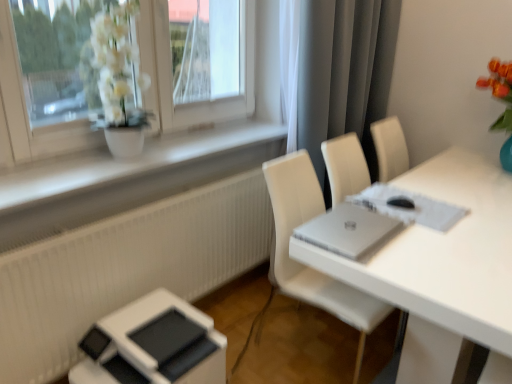
Identify the location of silver metallic laptop at center. (348, 230).

Looking at this image, measure the distance between point (353,33) and camera.

They are 2.29 meters apart.

The height and width of the screenshot is (384, 512). What do you see at coordinates (123, 163) in the screenshot? I see `white matte window sill at upper left` at bounding box center [123, 163].

Where is `white leather chair at right`? white leather chair at right is located at coordinates (304, 265).

Is white matte window sill at upper left in contact with silver metallic laptop at center?

white matte window sill at upper left and silver metallic laptop at center are not in contact.

Is white matte window sill at upper left wider than silver metallic laptop at center?

No, white matte window sill at upper left is not wider than silver metallic laptop at center.

Looking at this image, from a real-world perspective, which is physically below, white matte window sill at upper left or silver metallic laptop at center?

silver metallic laptop at center is physically lower.

Between white glossy table at center and white leather chair at right, which one has larger size?

With larger size is white glossy table at center.

Can you confirm if white glossy table at center is wider than white leather chair at right?

Indeed, white glossy table at center has a greater width compared to white leather chair at right.

What's the angular difference between white glossy table at center and white leather chair at right's facing directions?

They differ by 86.8 degrees in their facing directions.

Where is `chair on the left of white glossy table at center`? The height and width of the screenshot is (384, 512). chair on the left of white glossy table at center is located at coordinates (304, 265).

Visually, is white leather chair at right positioned to the left or to the right of white glossy table at center?

white leather chair at right is to the left of white glossy table at center.

Considering the sizes of objects white leather chair at right and white glossy table at center in the image provided, who is taller, white leather chair at right or white glossy table at center?

Standing taller between the two is white leather chair at right.

In the scene shown: Can we say white leather chair at right lies outside white glossy table at center?

No.

Does white leather chair at right have a greater width compared to white glossy table at center?

Incorrect, the width of white leather chair at right does not surpass that of white glossy table at center.

Does gray matte curtain at upper right touch white leather chair at right?

No, gray matte curtain at upper right is not in contact with white leather chair at right.

Is point (301, 18) closer to viewer compared to point (360, 340)?

No, (301, 18) is behind (360, 340).

Looking at this image, from the image's perspective, which one is positioned lower, gray matte curtain at upper right or white leather chair at right?

From the image's view, white leather chair at right is below.

Can you tell me how much gray matte curtain at upper right and white leather chair at right differ in facing direction?

1.31 degrees separate the facing orientations of gray matte curtain at upper right and white leather chair at right.

From a real-world perspective, is white leather chair at right positioned above or below silver metallic laptop at center?

Clearly, from a real-world perspective, white leather chair at right is below silver metallic laptop at center.

Can you tell me how much white leather chair at right and silver metallic laptop at center differ in facing direction?

85.7 degrees.

Does white leather chair at right appear on the left side of silver metallic laptop at center?

No.

Does point (360, 331) come farther from viewer compared to point (381, 225)?

Yes, point (360, 331) is behind point (381, 225).

Is silver metallic laptop at center shorter than white matte window sill at upper left?

Yes.

There is a silver metallic laptop at center. Identify the location of window sill above it (from a real-world perspective). This screenshot has width=512, height=384. (123, 163).

Who is bigger, silver metallic laptop at center or white matte window sill at upper left?

white matte window sill at upper left is bigger.

Is silver metallic laptop at center thinner than white matte window sill at upper left?

In fact, silver metallic laptop at center might be wider than white matte window sill at upper left.

Is white leather chair at right smaller than gray matte curtain at upper right?

Yes.

Considering the relative positions of white leather chair at right and gray matte curtain at upper right in the image provided, is white leather chair at right behind gray matte curtain at upper right?

No, white leather chair at right is in front of gray matte curtain at upper right.

From a real-world perspective, between white leather chair at right and gray matte curtain at upper right, who is vertically higher?

gray matte curtain at upper right.

The height and width of the screenshot is (384, 512). There is a silver metallic laptop at center. Find the location of `window sill above it (from a real-world perspective)`. window sill above it (from a real-world perspective) is located at coordinates (123, 163).

Locate an element on the screen. table on the right of white leather chair at right is located at coordinates (443, 271).

Considering their positions, is white glossy table at center positioned closer to white leather chair at right than silver metallic laptop at center?

silver metallic laptop at center is closer to white leather chair at right.

Based on their spatial positions, is white glossy table at center or gray matte curtain at upper right closer to white leather chair at right?

white glossy table at center is closer to white leather chair at right.

Considering their positions, is gray matte curtain at upper right positioned further to white glossy table at center than white leather chair at right?

Among the two, gray matte curtain at upper right is located further to white glossy table at center.

When comparing their distances from gray matte curtain at upper right, does white matte window sill at upper left or white leather chair at right seem closer?

Based on the image, white leather chair at right appears to be nearer to gray matte curtain at upper right.

Based on the photo, from the image, which object appears to be nearer to gray matte curtain at upper right, white matte window sill at upper left or silver metallic laptop at center?

Based on the image, white matte window sill at upper left appears to be nearer to gray matte curtain at upper right.

When comparing their distances from gray matte curtain at upper right, does white glossy table at center or white matte window sill at upper left seem closer?

Among the two, white matte window sill at upper left is located nearer to gray matte curtain at upper right.

Looking at the image, which one is located closer to gray matte curtain at upper right, white leather chair at right or silver metallic laptop at center?

white leather chair at right.

Based on their spatial positions, is white glossy table at center or silver metallic laptop at center closer to gray matte curtain at upper right?

Among the two, white glossy table at center is located nearer to gray matte curtain at upper right.

At what (x,y) coordinates should I click in order to perform the action: click on chair between white matte window sill at upper left and gray matte curtain at upper right in the horizontal direction. Please return your answer as a coordinate pair (x, y). Looking at the image, I should click on (304, 265).

Find the location of `laptop between white matte window sill at upper left and white glossy table at center in the horizontal direction`. laptop between white matte window sill at upper left and white glossy table at center in the horizontal direction is located at coordinates click(x=348, y=230).

The image size is (512, 384). I want to click on laptop situated between white matte window sill at upper left and white leather chair at right from left to right, so click(348, 230).

At what (x,y) coordinates should I click in order to perform the action: click on laptop between white matte window sill at upper left and gray matte curtain at upper right. Please return your answer as a coordinate pair (x, y). Looking at the image, I should click on tap(348, 230).